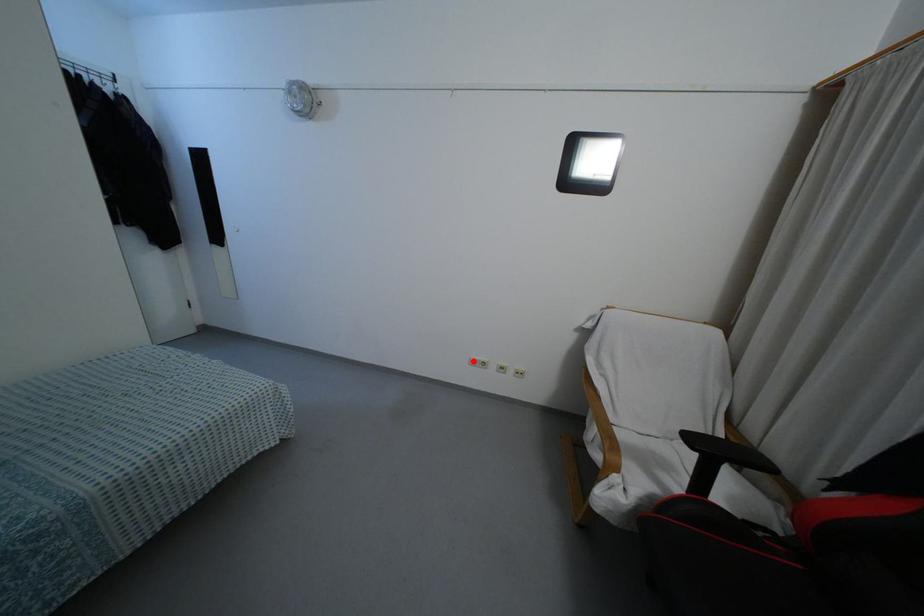
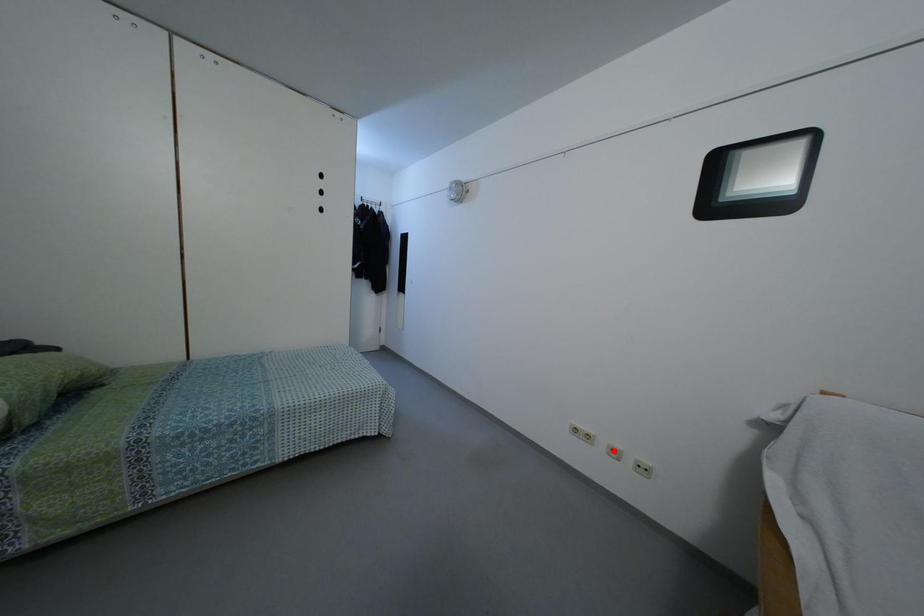
I am providing you with two images of the same scene from different viewpoints. A red point is marked on the first image and another point is marked on the second image. Are the points marked in image1 and image2 representing the same 3D position?

No